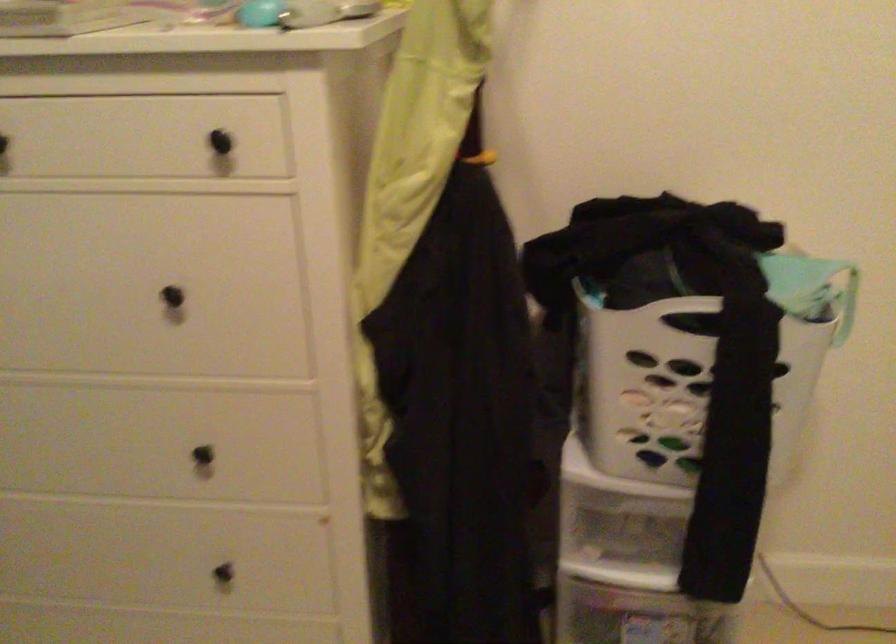
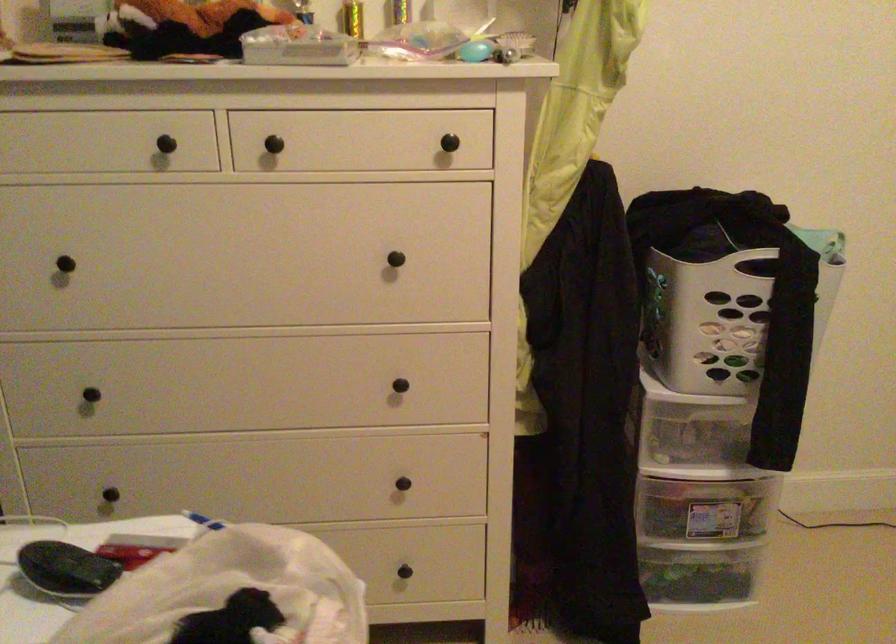
In the second image, find the point that corresponds to point 186,301 in the first image.

(400, 261)